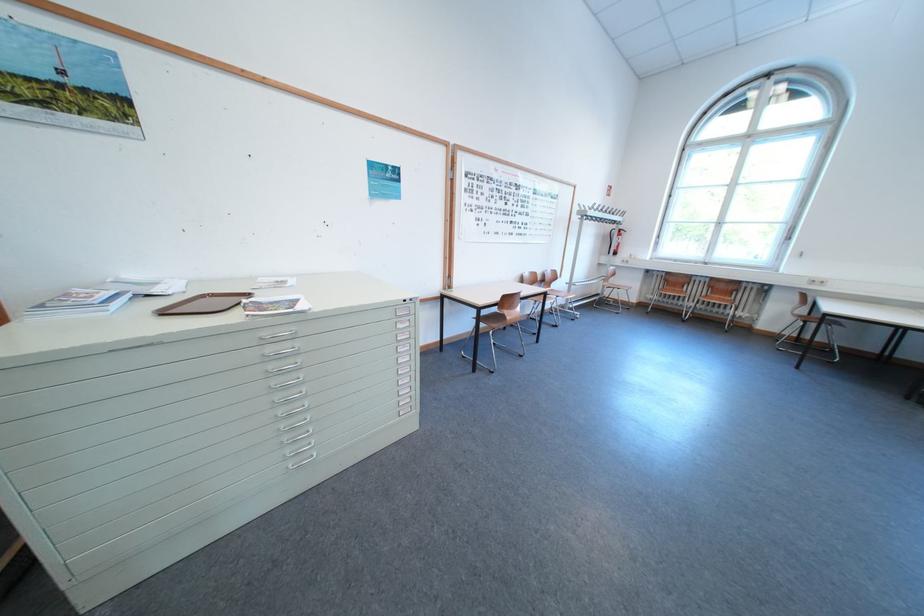
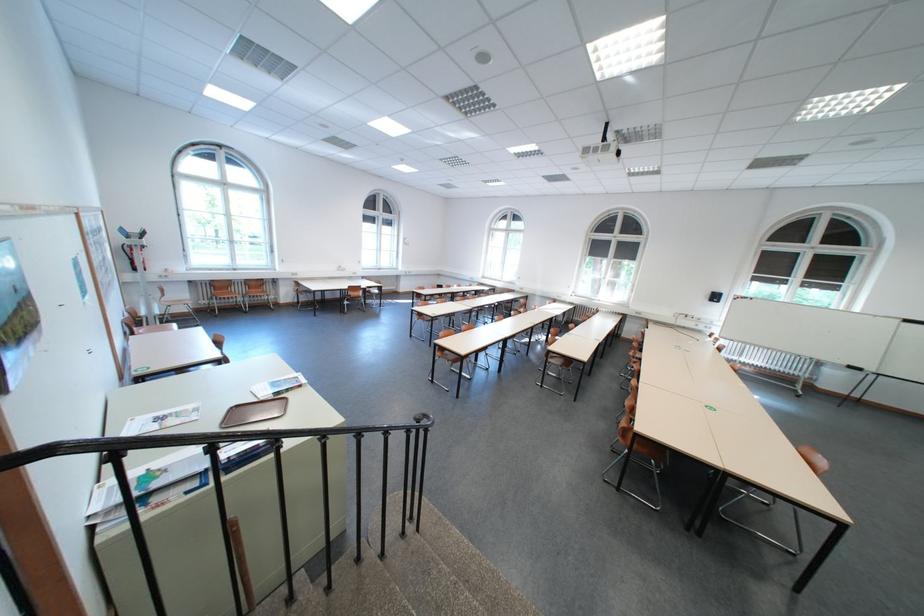
Find the pixel in the second image that matches point (710, 292) in the first image.

(252, 291)